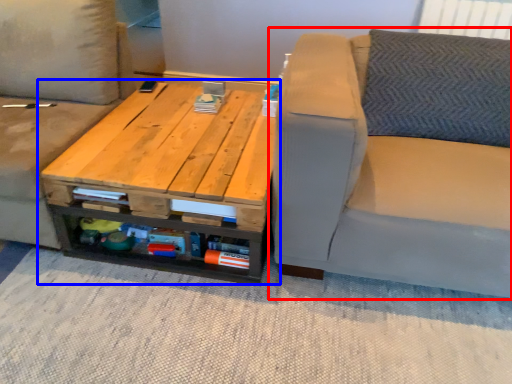
Question: Which object is closer to the camera taking this photo, studio couch (highlighted by a red box) or table (highlighted by a blue box)?

Choices:
 (A) studio couch
 (B) table

Answer: (A)